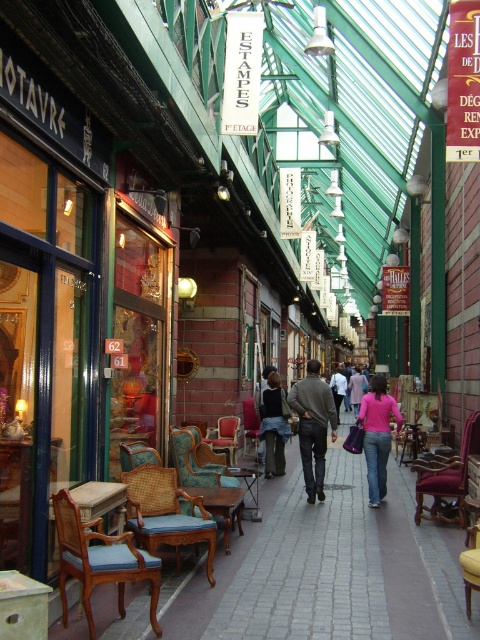
You are a customer standing in the shopping arcade and want to examine both the velvet burgundy armchair at center and the dark brown leather jacket at center. Which item can you see in more detail without moving closer?

The velvet burgundy armchair at center is closer to the viewer, so you can see it in more detail without moving closer compared to the dark brown leather jacket at center.